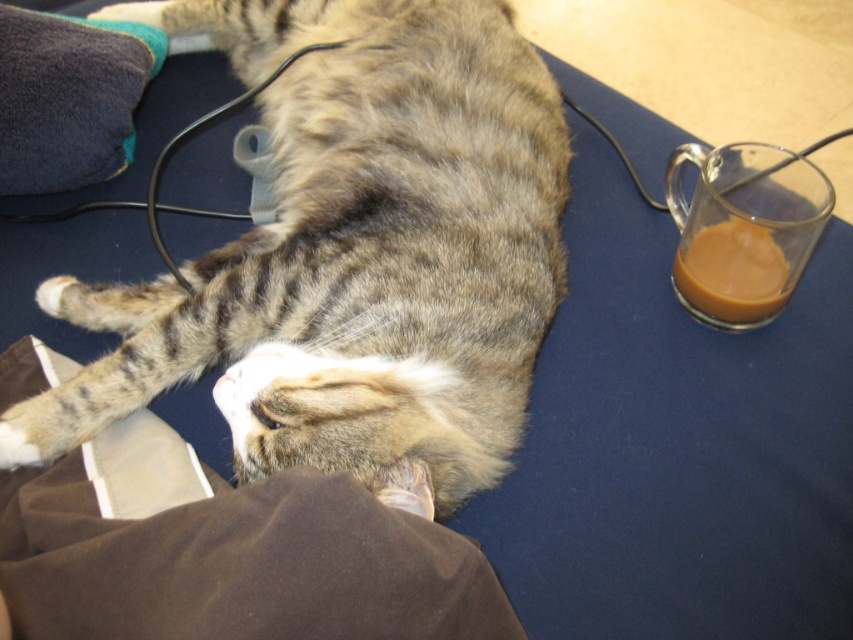
Which is more to the right, tabby fur cat at center or translucent glass mug at right?

Positioned to the right is translucent glass mug at right.

Can you confirm if tabby fur cat at center is positioned to the right of translucent glass mug at right?

Incorrect, tabby fur cat at center is not on the right side of translucent glass mug at right.

Locate an element on the screen. This screenshot has width=853, height=640. tabby fur cat at center is located at coordinates (350, 252).